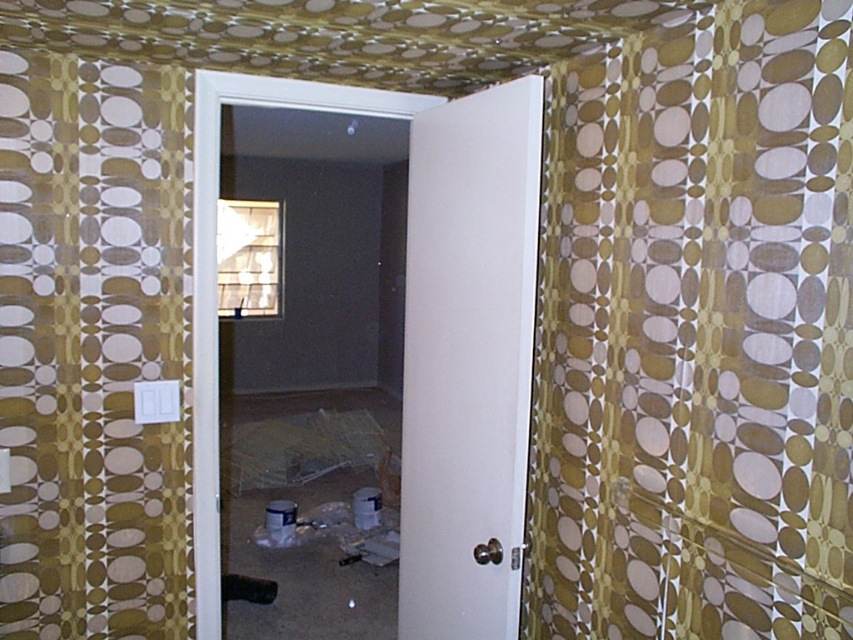
Which of these two, gold-patterned fabric curtain at center or gold textured curtain at left, stands taller?

gold textured curtain at left is taller.

Where is `gold-patterned fabric curtain at center`? The width and height of the screenshot is (853, 640). gold-patterned fabric curtain at center is located at coordinates (697, 333).

Identify the location of gold-patterned fabric curtain at center. (697, 333).